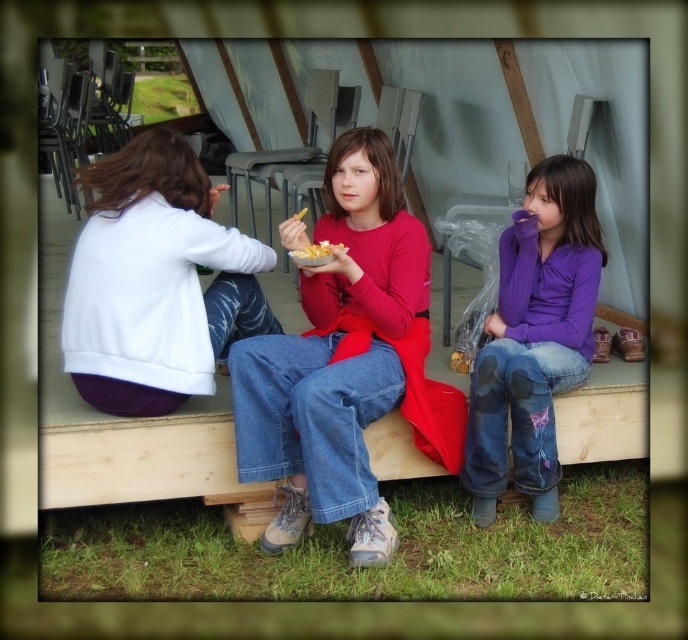
Between denim jeans at center and purple soft fabric shirt at center, which one has more height?

Standing taller between the two is denim jeans at center.

Identify the location of denim jeans at center. The width and height of the screenshot is (688, 640). (334, 356).

What do you see at coordinates (155, 282) in the screenshot? The height and width of the screenshot is (640, 688). I see `white matte sweatshirt at left` at bounding box center [155, 282].

Which is in front, point (127, 381) or point (305, 244)?

Point (127, 381) is in front.

Identify the location of white matte sweatshirt at left. (155, 282).

The image size is (688, 640). What do you see at coordinates (535, 339) in the screenshot?
I see `purple soft fabric shirt at center` at bounding box center [535, 339].

Does purple soft fabric shirt at center have a smaller size compared to yellow crispy snack at center?

Incorrect, purple soft fabric shirt at center is not smaller in size than yellow crispy snack at center.

Which is behind, point (469, 449) or point (294, 250)?

Positioned behind is point (469, 449).

The width and height of the screenshot is (688, 640). What are the coordinates of `purple soft fabric shirt at center` in the screenshot? It's located at coord(535,339).